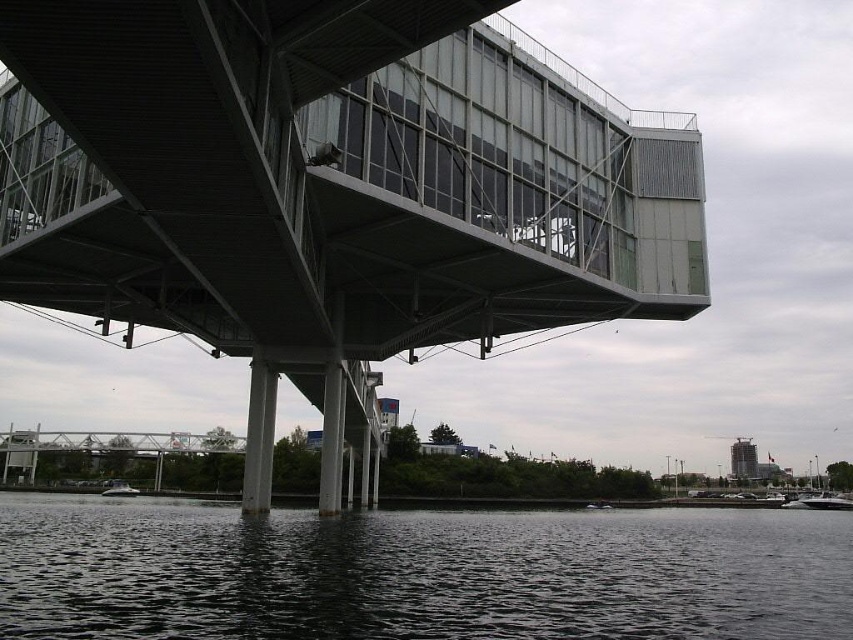
The width and height of the screenshot is (853, 640). What do you see at coordinates (329, 189) in the screenshot?
I see `metallic gray bridge at upper center` at bounding box center [329, 189].

Is metallic gray bridge at upper center thinner than dark water at lower center?

Yes.

What do you see at coordinates (329, 189) in the screenshot? The image size is (853, 640). I see `metallic gray bridge at upper center` at bounding box center [329, 189].

Locate an element on the screen. The height and width of the screenshot is (640, 853). metallic gray bridge at upper center is located at coordinates (329, 189).

The height and width of the screenshot is (640, 853). What do you see at coordinates (418, 572) in the screenshot?
I see `dark water at lower center` at bounding box center [418, 572].

Can you confirm if dark water at lower center is thinner than white glossy boat at lower right?

Incorrect, dark water at lower center's width is not less than white glossy boat at lower right's.

Identify the location of dark water at lower center. The width and height of the screenshot is (853, 640). (418, 572).

Locate an element on the screen. The width and height of the screenshot is (853, 640). dark water at lower center is located at coordinates (418, 572).

Who is positioned more to the right, dark water at lower center or white glossy boat at lower left?

Positioned to the right is dark water at lower center.

Can you confirm if dark water at lower center is thinner than white glossy boat at lower left?

In fact, dark water at lower center might be wider than white glossy boat at lower left.

Between point (457, 628) and point (106, 492), which one is positioned behind?

Point (106, 492)

Image resolution: width=853 pixels, height=640 pixels. I want to click on dark water at lower center, so click(x=418, y=572).